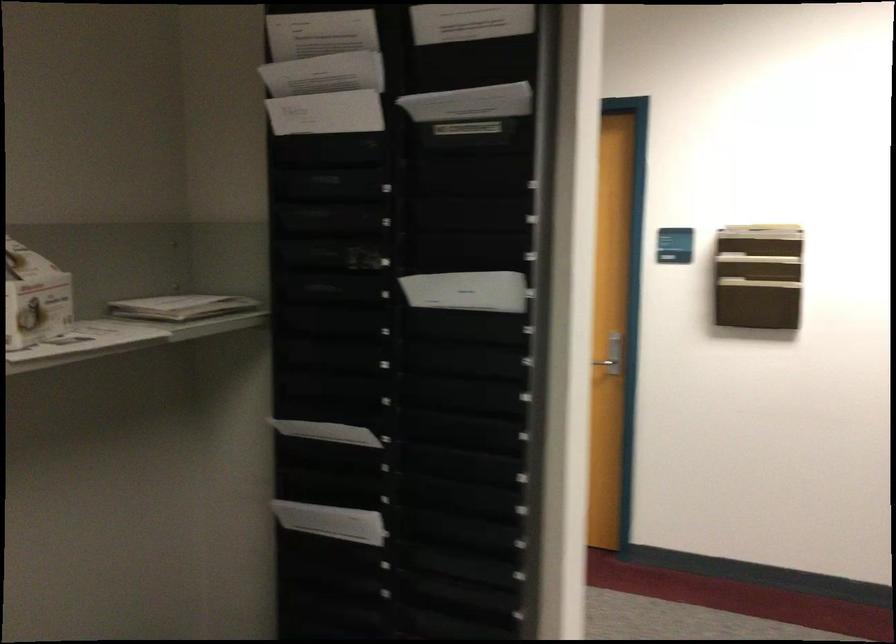
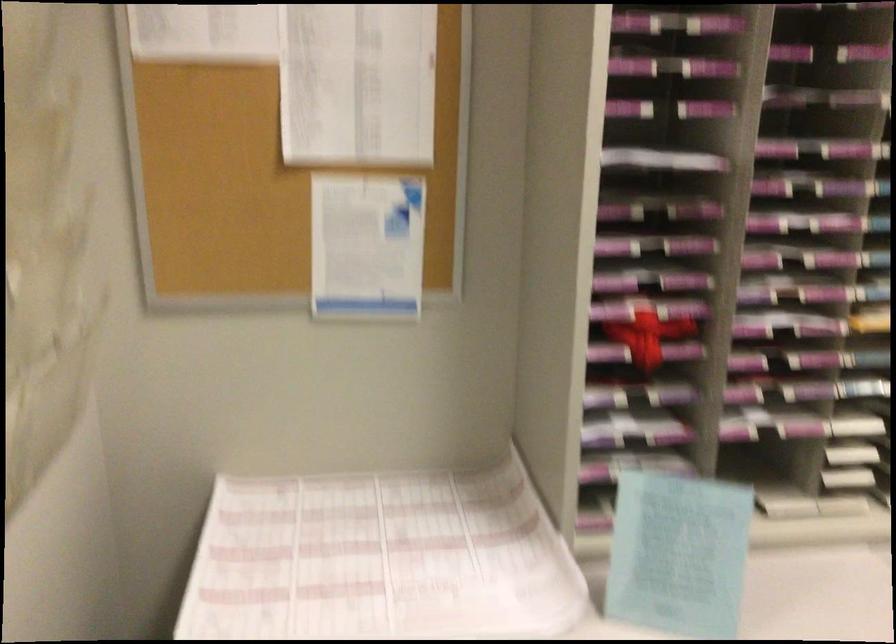
The images are taken continuously from a first-person perspective. In which direction is your viewpoint rotating?

The rotation direction of the camera is right-down.